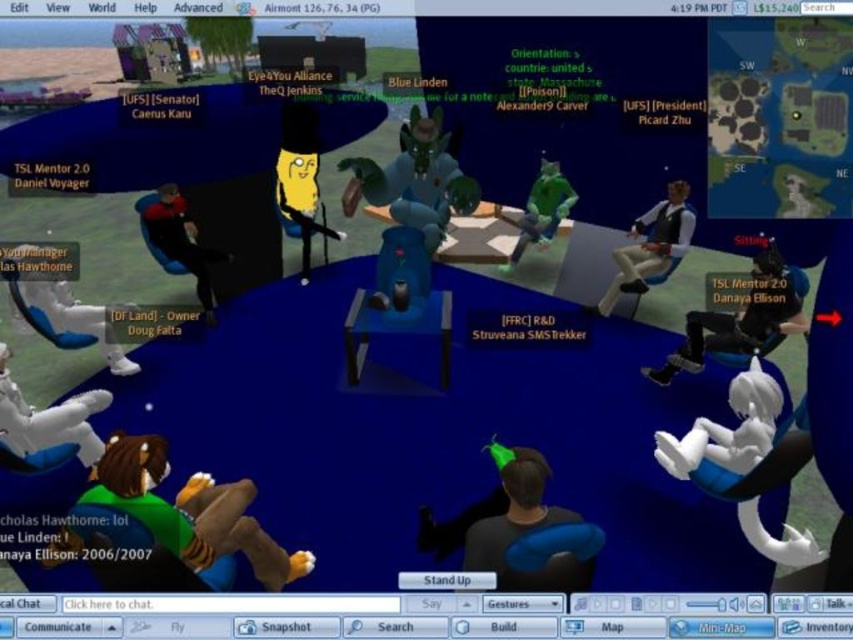
Does black matte hair at center appear under matte black suit at left?

Indeed, black matte hair at center is positioned under matte black suit at left.

Does black matte hair at center appear over matte black suit at left?

Incorrect, black matte hair at center is not positioned above matte black suit at left.

You are a GUI agent. You are given a task and a screenshot of the screen. Output one action in this format:
    pyautogui.click(x=<x>, y=<y>)
    Task: Click on the black matte hair at center
    
    Given the screenshot: What is the action you would take?
    pyautogui.click(x=524, y=531)

Can you confirm if black matte hair at center is positioned above white plush toy at right?

No.

Can you confirm if black matte hair at center is smaller than white plush toy at right?

Yes.

Describe the element at coordinates (524, 531) in the screenshot. I see `black matte hair at center` at that location.

This screenshot has height=640, width=853. I want to click on black matte hair at center, so click(x=524, y=531).

Is green fuzzy bear at lower left to the left of white plush toy at lower left from the viewer's perspective?

Incorrect, green fuzzy bear at lower left is not on the left side of white plush toy at lower left.

Is green fuzzy bear at lower left shorter than white plush toy at lower left?

Incorrect, green fuzzy bear at lower left's height does not fall short of white plush toy at lower left's.

Which is behind, point (138, 481) or point (93, 461)?

Point (93, 461)

This screenshot has height=640, width=853. I want to click on green fuzzy bear at lower left, so click(x=166, y=525).